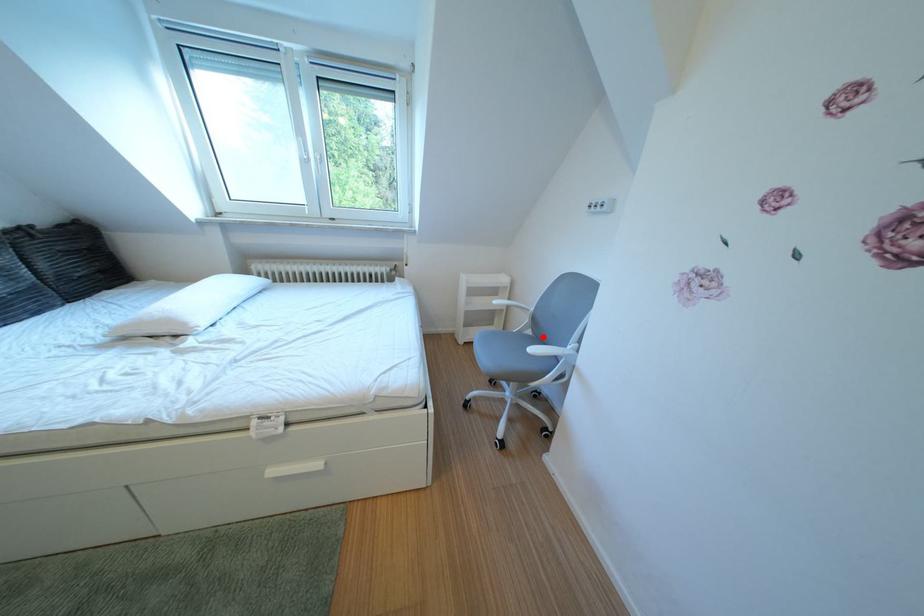
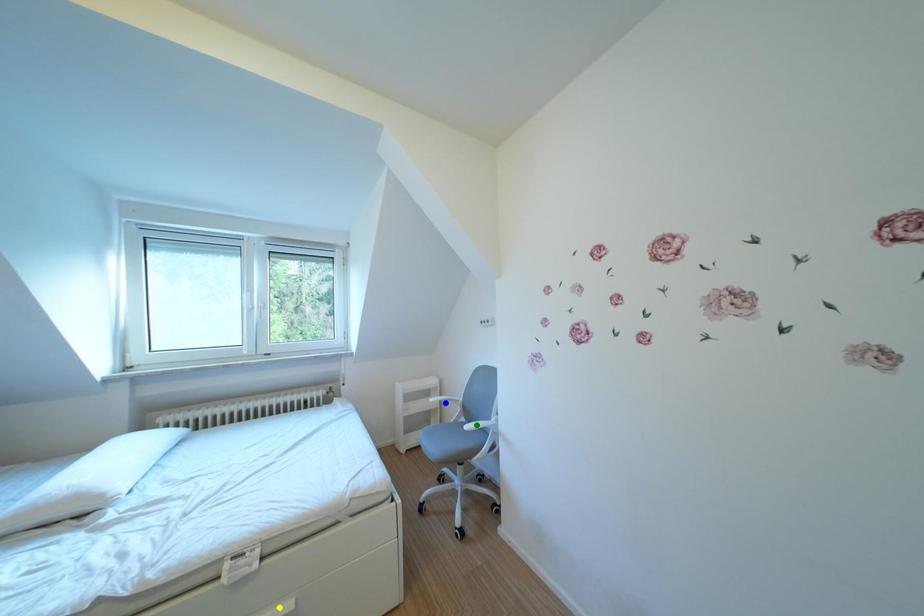
Question: I am providing you with two images of the same scene from different viewpoints. A red point is marked on the first image. You are given multiple points on the second image. In image 2, which mark is for the same physical point as the one in image 1?

Choices:
 (A) yellow point
 (B) blue point
 (C) green point

Answer: (C)